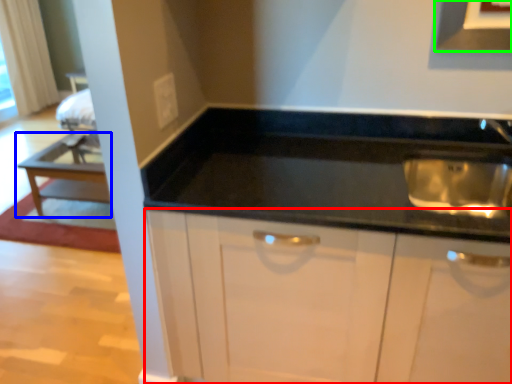
Question: Based on their relative distances, which object is nearer to cabinetry (highlighted by a red box)? Choose from table (highlighted by a blue box) and exhaust hood (highlighted by a green box).

Choices:
 (A) table
 (B) exhaust hood

Answer: (B)